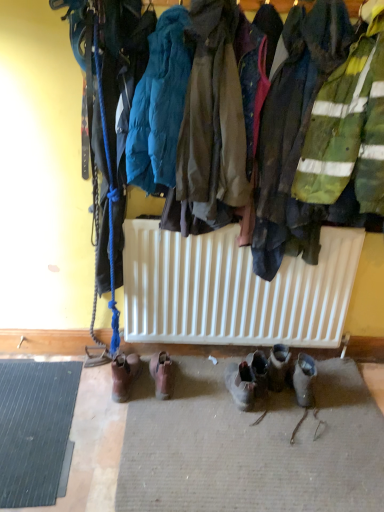
Question: From the image's perspective, is brown leather boots at lower center, the 3th footwear from the left, located above or below brown fabric jacket at center, which is counted as the 1th jacket, starting from the right?

Choices:
 (A) below
 (B) above

Answer: (A)

Question: Considering the positions of brown leather boots at lower center, the 3th footwear from the left, and brown fabric jacket at center, which is counted as the 1th jacket, starting from the right, in the image, is brown leather boots at lower center, the 3th footwear from the left, taller or shorter than brown fabric jacket at center, which is counted as the 1th jacket, starting from the right,?

Choices:
 (A) short
 (B) tall

Answer: (A)

Question: Estimate the real-world distances between objects in this image. Which object is farther from the brown fabric jacket at center, the 2th jacket positioned from the left?

Choices:
 (A) brown leather boots at lower center, the first footwear in the left-to-right sequence
 (B) brown leather boots at center, placed as the third footwear when sorted from right to left
 (C) brown leather boots at lower center, the first footwear in the right-to-left sequence
 (D) brown leather boots at lower center, the 2th footwear positioned from the right
 (E) teal puffy jacket at upper center, marked as the second jacket in a right-to-left arrangement

Answer: (C)

Question: Which of these objects is positioned closest to the teal puffy jacket at upper center, which appears as the first jacket when viewed from the left?

Choices:
 (A) brown leather boots at center, placed as the third footwear when sorted from right to left
 (B) black rubber mat at lower left
 (C) brown leather boots at lower center, the first footwear in the right-to-left sequence
 (D) brown fabric jacket at center, which is counted as the 1th jacket, starting from the right
 (E) brown leather boots at lower center, the 3th footwear from the left

Answer: (D)